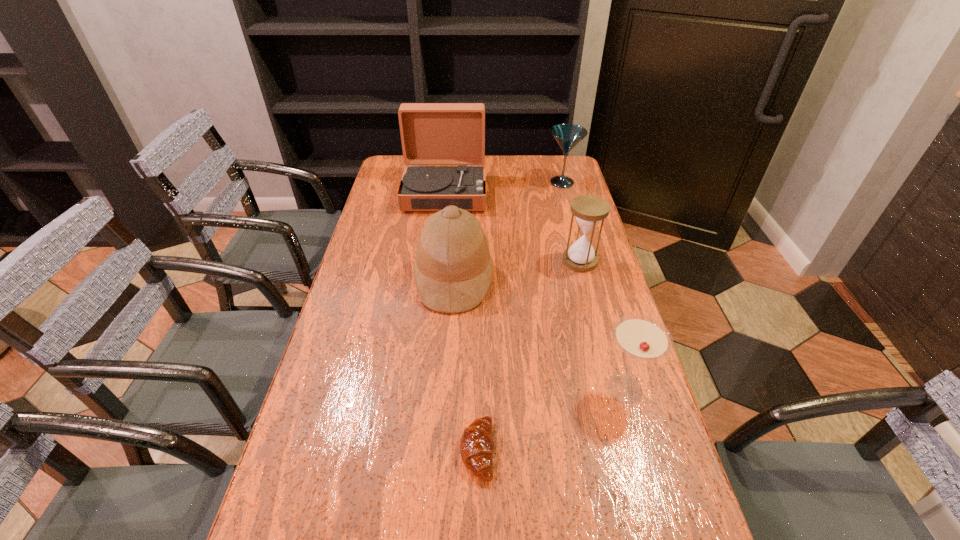
Where is `vacant space at the left edge`? This screenshot has height=540, width=960. vacant space at the left edge is located at coordinates (315, 433).

Locate an element on the screen. This screenshot has height=540, width=960. vacant area at the right edge of the desktop is located at coordinates (609, 284).

Find the location of `vacant region at the far left corner`. vacant region at the far left corner is located at coordinates (387, 181).

Image resolution: width=960 pixels, height=540 pixels. Identify the location of free space at the far right corner of the desktop. (556, 155).

This screenshot has height=540, width=960. In order to click on empty space that is in between the hourglass and the crescent roll in this screenshot , I will do `click(529, 356)`.

The height and width of the screenshot is (540, 960). Identify the location of free space between the tallest object and the hourglass. (513, 227).

Locate an element on the screen. The image size is (960, 540). vacant region between the phonograph record and the hourglass is located at coordinates (513, 227).

Locate an element on the screen. free point between the hat and the hourglass is located at coordinates (516, 269).

Locate an element on the screen. free space between the phonograph record and the shortest object is located at coordinates (461, 322).

Where is `free space between the shortest object and the farther martini`? The width and height of the screenshot is (960, 540). free space between the shortest object and the farther martini is located at coordinates (519, 316).